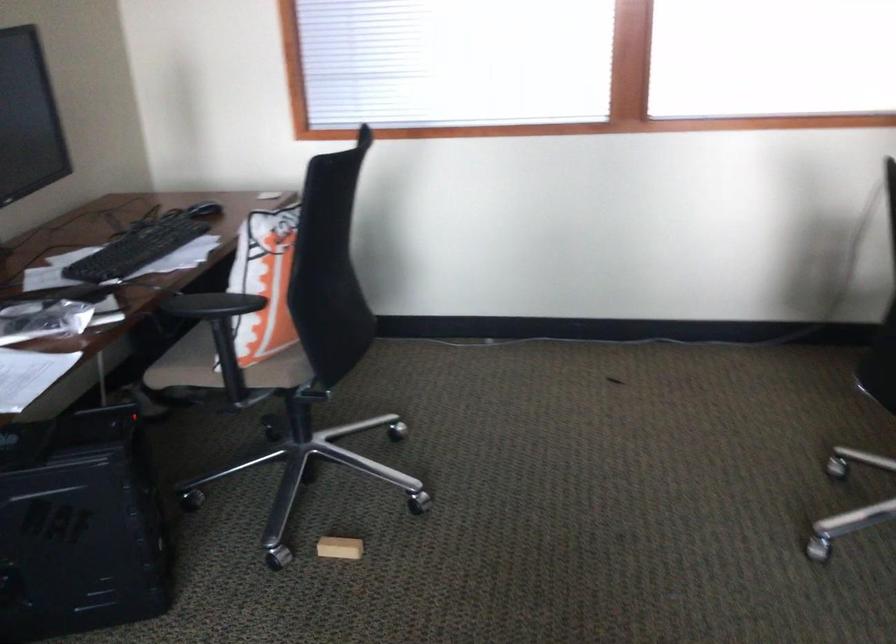
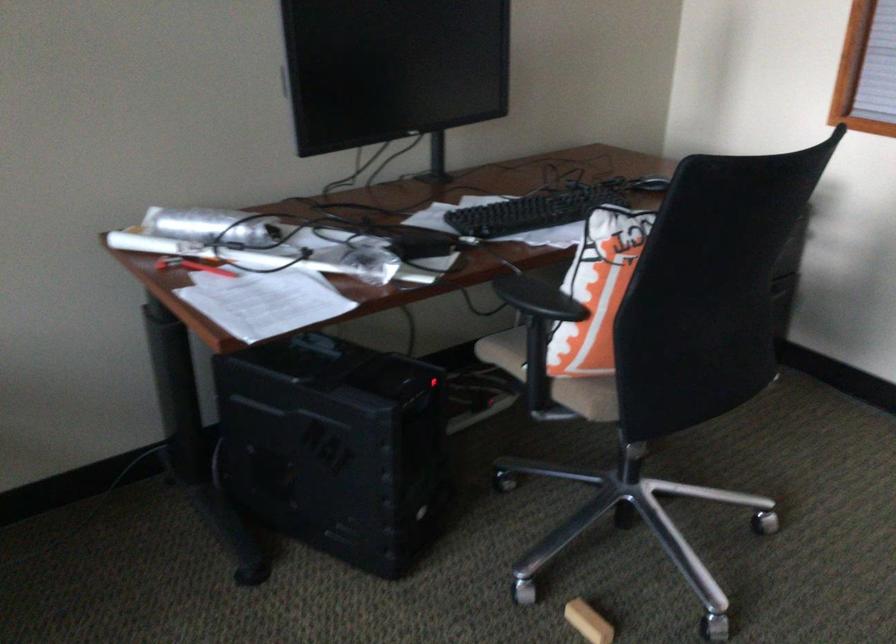
Locate, in the second image, the point that corresponds to (228,299) in the first image.

(538, 299)